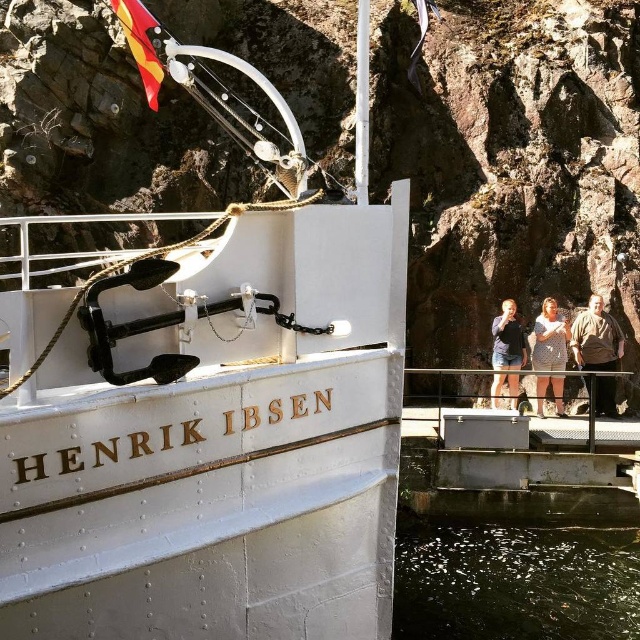
You are a passenger on the HENRIK IBSEN ship and you want to place your belongings on the deck. You have a brown leather jacket at right and denim shorts at center. Which item is positioned lower on the deck?

The brown leather jacket at right is located below denim shorts at center, so it is positioned lower on the deck.

You are standing on the deck of the HENRIK IBSEN ship and want to place a pair of denim shorts somewhere. Given the white polished wood boat at center and the denim shorts at center, which object should you place the denim shorts closer to if you want them to be more visible from your current position?

The white polished wood boat at center is closer to the viewer than the denim shorts at center. To make the denim shorts more visible from your current position, you should place them closer to the white polished wood boat at center, as objects closer to the viewer are more visible.